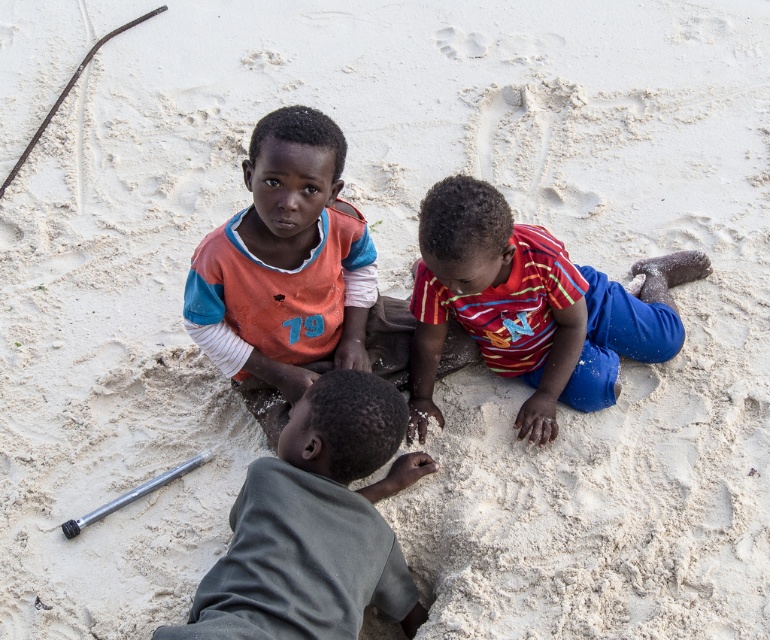
Is orange jersey at center bigger than striped cotton shirt at center?

No.

Between point (283, 252) and point (650, 336), which one is positioned in front?

Point (283, 252) is in front.

At what (x,y) coordinates should I click in order to perform the action: click on orange jersey at center. Please return your answer as a coordinate pair (x, y). This screenshot has height=640, width=770. Looking at the image, I should click on (293, 275).

Can you confirm if orange jersey at center is thinner than dark gray cotton shirt at lower left?

In fact, orange jersey at center might be wider than dark gray cotton shirt at lower left.

Which of these two, orange jersey at center or dark gray cotton shirt at lower left, stands shorter?

dark gray cotton shirt at lower left

The image size is (770, 640). What do you see at coordinates (293, 275) in the screenshot? I see `orange jersey at center` at bounding box center [293, 275].

Identify the location of orange jersey at center. (293, 275).

Between dark gray cotton shirt at lower left and striped cotton shirt at center, which one has less height?

With less height is dark gray cotton shirt at lower left.

Can you confirm if dark gray cotton shirt at lower left is thinner than striped cotton shirt at center?

Correct, dark gray cotton shirt at lower left's width is less than striped cotton shirt at center's.

Find the location of `dark gray cotton shirt at lower left`. dark gray cotton shirt at lower left is located at coordinates (315, 525).